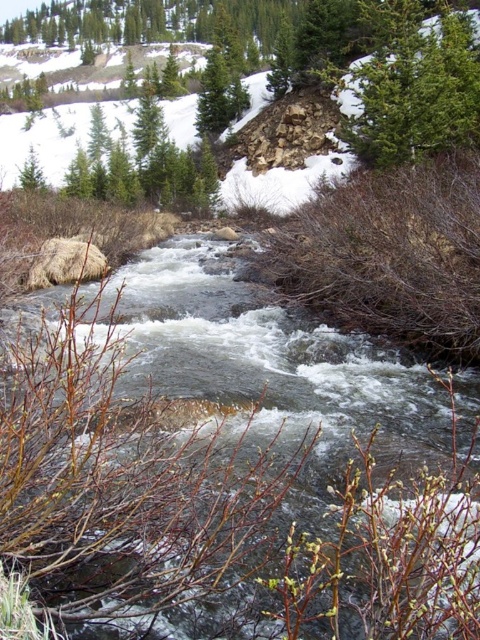
Who is positioned more to the right, clear water at center or green textured evergreen tree at upper center?

From the viewer's perspective, green textured evergreen tree at upper center appears more on the right side.

Can you confirm if clear water at center is positioned to the right of green textured evergreen tree at upper center?

In fact, clear water at center is to the left of green textured evergreen tree at upper center.

Does point (319, 332) come closer to viewer compared to point (427, 83)?

Yes, it is.

In order to click on clear water at center in this screenshot , I will do `click(264, 349)`.